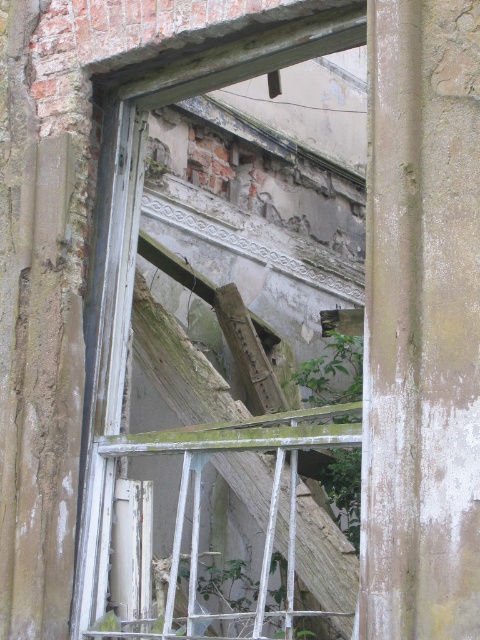
Is white painted wood window frame at center thinner than green leafy plant at center?

No, white painted wood window frame at center is not thinner than green leafy plant at center.

Is white painted wood window frame at center smaller than green leafy plant at center?

Correct, white painted wood window frame at center occupies less space than green leafy plant at center.

I want to click on white painted wood window frame at center, so click(x=134, y=252).

Find the location of `white painted wood window frame at center`. white painted wood window frame at center is located at coordinates (134, 252).